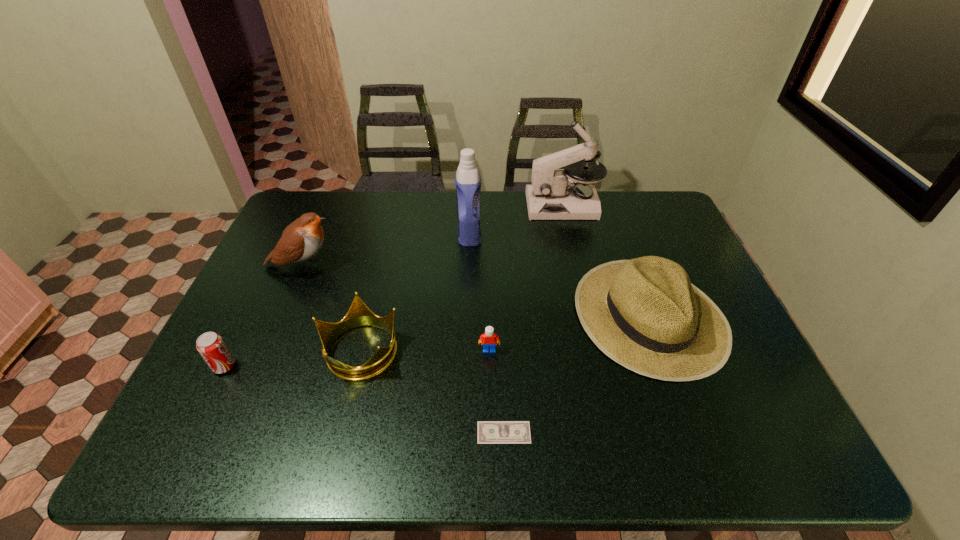
Where is `free space between the bird and the detergent`? The image size is (960, 540). free space between the bird and the detergent is located at coordinates (386, 249).

The width and height of the screenshot is (960, 540). I want to click on vacant space that is in between the sixth shortest object and the microscope, so click(x=433, y=235).

You are a GUI agent. You are given a task and a screenshot of the screen. Output one action in this format:
    pyautogui.click(x=<x>, y=<y>)
    Task: Click on the empty space that is in between the bird and the soda can
    The width and height of the screenshot is (960, 540).
    Given the screenshot: What is the action you would take?
    pyautogui.click(x=263, y=316)

Identify the location of free area in between the sunhat and the shortest object. The width and height of the screenshot is (960, 540). (577, 374).

Identify the location of vacant area between the microscope and the soda can. This screenshot has width=960, height=540. (394, 286).

This screenshot has width=960, height=540. I want to click on free space between the seventh tallest object and the bird, so click(396, 308).

Image resolution: width=960 pixels, height=540 pixels. Identify the location of vacant area between the shortest object and the seventh tallest object. (496, 392).

This screenshot has height=540, width=960. What are the coordinates of `vacant area that lies between the money and the bird` in the screenshot? It's located at (403, 349).

Select which object appears as the fourth closest to the sunhat. Please provide its 2D coordinates. Your answer should be formatted as a tuple, i.e. [(x, y)], where the tuple contains the x and y coordinates of a point satisfying the conditions above.

[(468, 183)]

Locate which object ranks second in proximity to the detergent. Please provide its 2D coordinates. Your answer should be formatted as a tuple, i.e. [(x, y)], where the tuple contains the x and y coordinates of a point satisfying the conditions above.

[(645, 314)]